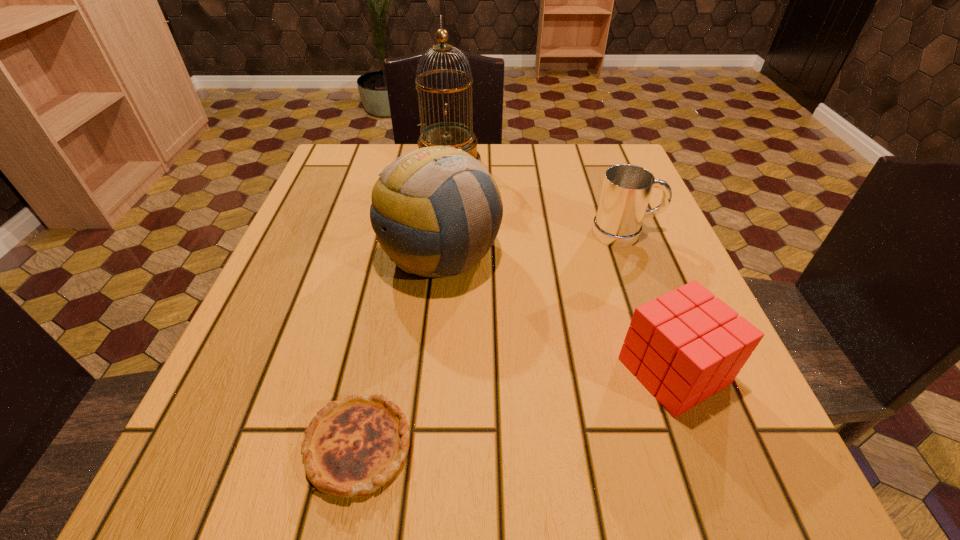
Image resolution: width=960 pixels, height=540 pixels. Identify the location of free region at the near left corner. (182, 455).

At what (x,y) coordinates should I click in order to perform the action: click on vacant region at the near right corner of the desktop. Please return your answer as a coordinate pair (x, y). The height and width of the screenshot is (540, 960). Looking at the image, I should click on (737, 495).

Image resolution: width=960 pixels, height=540 pixels. Identify the location of vacant area that lies between the fourth shortest object and the quiche. (399, 351).

This screenshot has width=960, height=540. What are the coordinates of `vacant area between the cube and the second tallest object` in the screenshot? It's located at (557, 313).

Where is `empty space between the cube and the birdcage`? The width and height of the screenshot is (960, 540). empty space between the cube and the birdcage is located at coordinates (561, 267).

The image size is (960, 540). I want to click on free space that is in between the mug and the tallest object, so click(538, 198).

The image size is (960, 540). I want to click on vacant space that's between the tallest object and the quiche, so click(404, 305).

The width and height of the screenshot is (960, 540). I want to click on unoccupied position between the volleyball and the shortest object, so click(399, 351).

At what (x,y) coordinates should I click in order to perform the action: click on free space between the quiche and the farthest object. Please return your answer as a coordinate pair (x, y). Image resolution: width=960 pixels, height=540 pixels. Looking at the image, I should click on (404, 305).

The height and width of the screenshot is (540, 960). What are the coordinates of `vacant region between the cube and the second tallest object` in the screenshot? It's located at (557, 313).